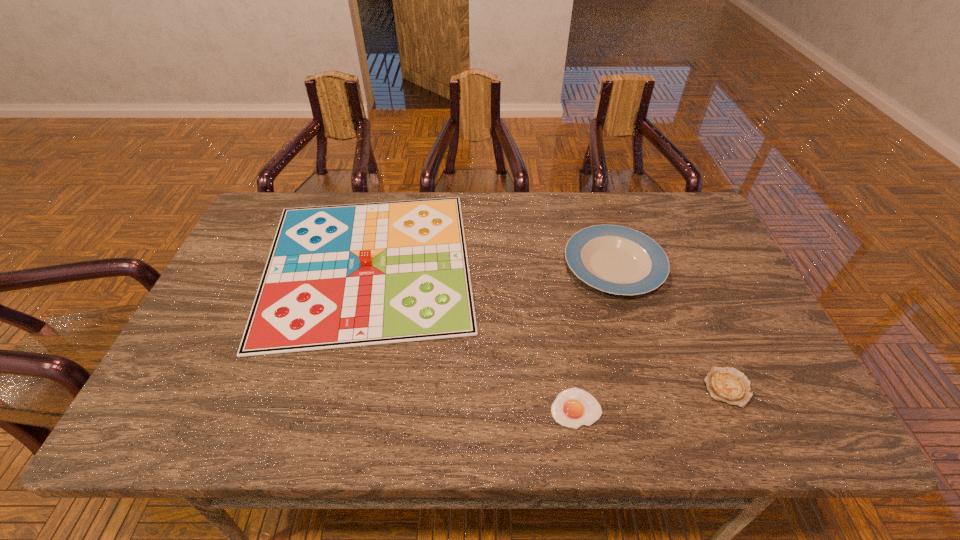
Identify the location of vacant space that satisfies the following two spatial constraints: 1. on the back side of the egg yolk; 2. on the right side of the third tallest object. 572,388.

The height and width of the screenshot is (540, 960). Find the location of `free space that satisfies the following two spatial constraints: 1. on the front side of the egg yolk; 2. on the left side of the gameboard`. free space that satisfies the following two spatial constraints: 1. on the front side of the egg yolk; 2. on the left side of the gameboard is located at coordinates (331, 408).